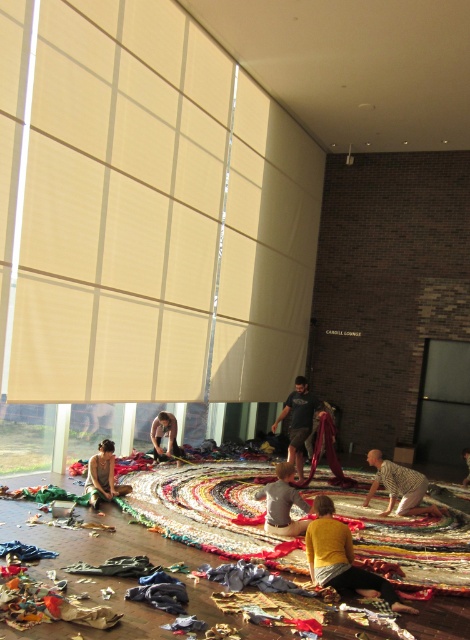
From the picture: Which of these two, multicolored fabric rug at lower left or striped fabric at center, stands shorter?

multicolored fabric rug at lower left

Is multicolored fabric rug at lower left further to camera compared to striped fabric at center?

No, it is not.

Find the location of a particular element. multicolored fabric rug at lower left is located at coordinates (211, 509).

Identify the location of striped fabric at center. (399, 486).

Which is above, striped fabric at center or yellow textured shirt at lower right?

striped fabric at center is above.

Measure the distance between striped fabric at center and camera.

striped fabric at center and camera are 7.24 meters apart.

Where is `striped fabric at center`? The image size is (470, 640). striped fabric at center is located at coordinates (399, 486).

Which is behind, point (297, 428) or point (112, 484)?

Point (297, 428)

Is dark gray t-shirt at center closer to camera compared to matte black fabric at lower left?

No, dark gray t-shirt at center is further to the viewer.

Is point (299, 464) positioned behind point (122, 493)?

That is True.

I want to click on dark gray t-shirt at center, so click(298, 420).